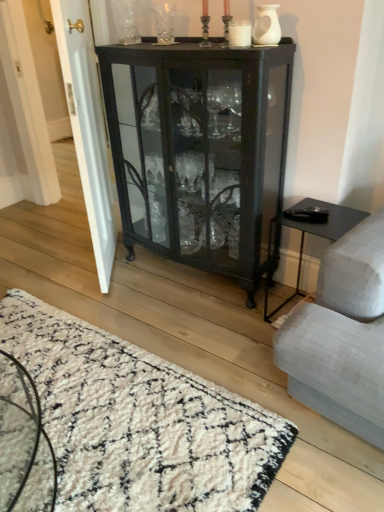
Question: Which direction should I rotate to look at clear glass vase at upper center, placed as the second glass vase when sorted from front to back?

Choices:
 (A) right
 (B) left

Answer: (B)

Question: Could you tell me if clear glass vase at upper center, placed as the second glass vase when sorted from front to back, is turned towards white glossy door at left?

Choices:
 (A) no
 (B) yes

Answer: (B)

Question: Considering the relative sizes of clear glass vase at upper center, the 1th glass vase in the top-to-bottom sequence, and white glossy door at left in the image provided, is clear glass vase at upper center, the 1th glass vase in the top-to-bottom sequence, thinner than white glossy door at left?

Choices:
 (A) yes
 (B) no

Answer: (A)

Question: Is clear glass vase at upper center, the 1th glass vase in the top-to-bottom sequence, smaller than white glossy door at left?

Choices:
 (A) yes
 (B) no

Answer: (A)

Question: Is clear glass vase at upper center, the 1th glass vase in the top-to-bottom sequence, positioned with its back to white glossy door at left?

Choices:
 (A) no
 (B) yes

Answer: (A)

Question: Is white glossy door at left a part of clear glass vase at upper center, which ranks as the 1th glass vase in left-to-right order?

Choices:
 (A) no
 (B) yes

Answer: (A)

Question: Is clear glass vase at upper center, the 2th glass vase viewed from the right, located outside white glossy door at left?

Choices:
 (A) no
 (B) yes

Answer: (B)

Question: Is white glossy door at left far from white shaggy rug at lower left?

Choices:
 (A) yes
 (B) no

Answer: (B)

Question: Does white glossy door at left have a greater height compared to white shaggy rug at lower left?

Choices:
 (A) yes
 (B) no

Answer: (A)

Question: Considering the relative positions of white glossy door at left and white shaggy rug at lower left in the image provided, is white glossy door at left to the right of white shaggy rug at lower left from the viewer's perspective?

Choices:
 (A) yes
 (B) no

Answer: (B)

Question: Is white glossy door at left facing away from white shaggy rug at lower left?

Choices:
 (A) no
 (B) yes

Answer: (A)

Question: Does white glossy door at left lie in front of white shaggy rug at lower left?

Choices:
 (A) yes
 (B) no

Answer: (B)

Question: Can you confirm if white glossy door at left is smaller than white shaggy rug at lower left?

Choices:
 (A) no
 (B) yes

Answer: (A)

Question: From the image's perspective, is white glossy door at left located above white matte vase at upper center, which is the first glass vase in front-to-back order?

Choices:
 (A) no
 (B) yes

Answer: (A)